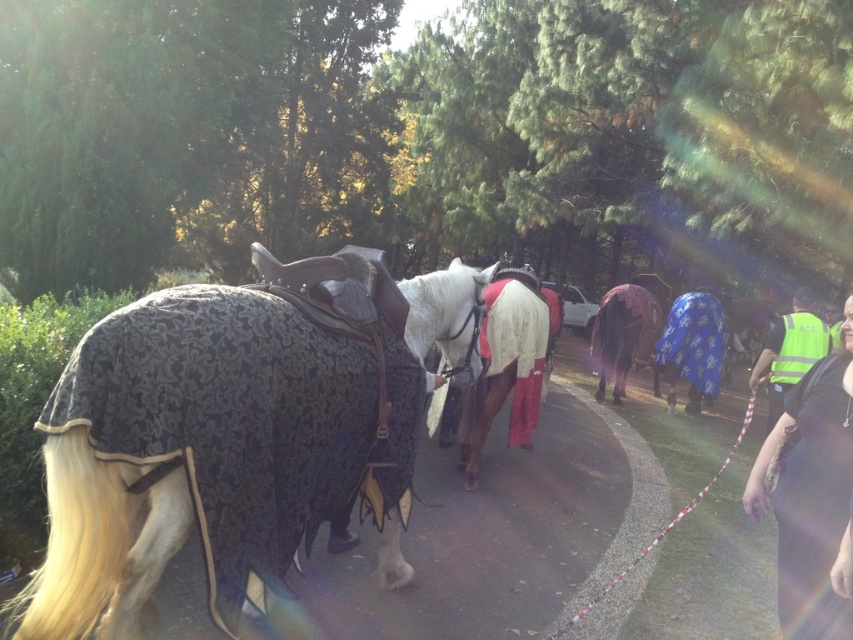
Question: Is blue patterned blanket at center above dark brown fabric horse at center?

Choices:
 (A) yes
 (B) no

Answer: (B)

Question: In this image, where is blue patterned blanket at center located relative to yellow reflective vest at right?

Choices:
 (A) right
 (B) left

Answer: (A)

Question: Which point is farther from the camera taking this photo?

Choices:
 (A) (44, 444)
 (B) (529, 440)
 (C) (770, 428)

Answer: (C)

Question: Which point is closer to the camera?

Choices:
 (A) black textured blanket at left
 (B) blue patterned blanket at center
 (C) reflective yellow vest at right

Answer: (C)

Question: Which point is closer to the camera?

Choices:
 (A) (679, 333)
 (B) (54, 600)

Answer: (B)

Question: Can you confirm if blue patterned blanket at center is smaller than yellow reflective vest at right?

Choices:
 (A) yes
 (B) no

Answer: (B)